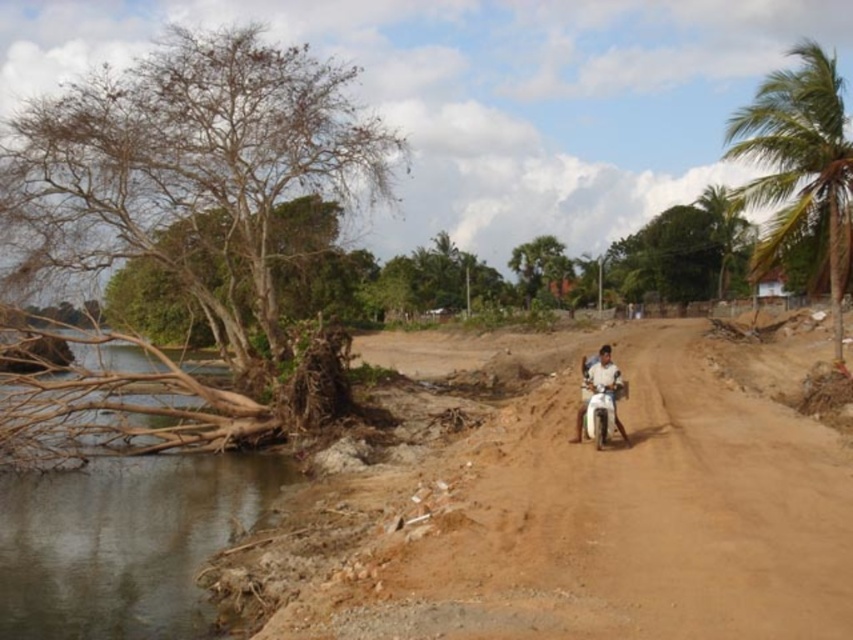
Question: From the image, what is the correct spatial relationship of green leafy palm tree at right in relation to white matte motorcycle at center?

Choices:
 (A) left
 (B) right

Answer: (B)

Question: Which point is farther to the camera?

Choices:
 (A) green leafy palm tree at right
 (B) white matte motorcycle at center

Answer: (A)

Question: Where is brown sandy dirt track at center located in relation to green leafy palm tree at right in the image?

Choices:
 (A) below
 (B) above

Answer: (A)

Question: Which point appears closest to the camera in this image?

Choices:
 (A) (601, 355)
 (B) (676, 484)

Answer: (B)

Question: Based on their relative distances, which object is farther from the green leafy tree at center?

Choices:
 (A) green leafy palm tree at right
 (B) brown dry wood at left
 (C) white matte motorcycle at center
 (D) brown sandy dirt track at center

Answer: (C)

Question: Is brown dry wood at left thinner than white matte motorcycle at center?

Choices:
 (A) yes
 (B) no

Answer: (B)